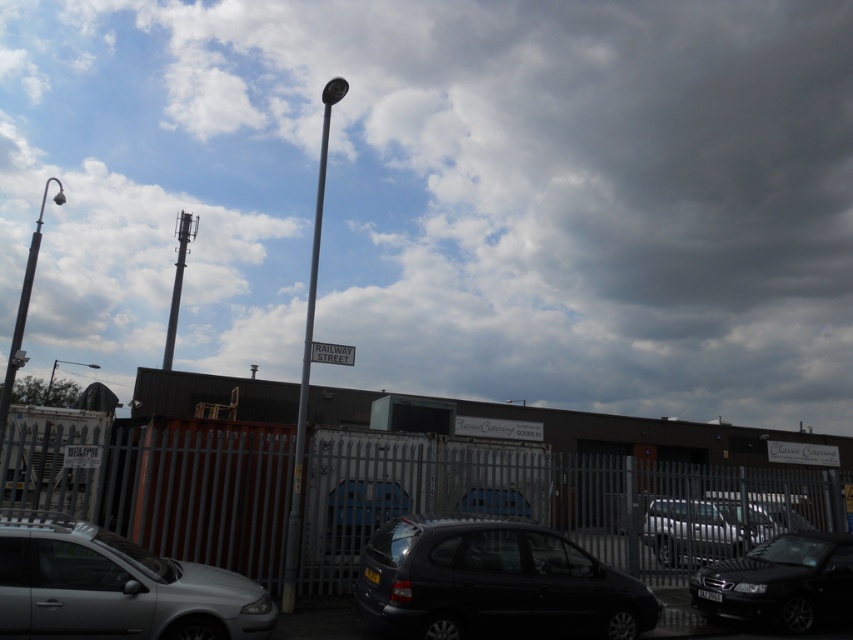
Does point (390, 547) come in front of point (833, 584)?

Yes, it is.

Locate an element on the screen. The width and height of the screenshot is (853, 640). matte black car at center is located at coordinates tap(492, 582).

Is matte black car at center in front of metallic pole at upper center?

Yes, matte black car at center is closer to the viewer.

Does matte black car at center have a greater height compared to metallic pole at upper center?

Incorrect, matte black car at center's height is not larger of metallic pole at upper center's.

Is point (543, 570) closer to camera compared to point (184, 257)?

Yes, it is.

Locate an element on the screen. The height and width of the screenshot is (640, 853). matte black car at center is located at coordinates (492, 582).

How much distance is there between black glossy car at lower right and metallic pole at upper center?

26.88 meters

Is black glossy car at lower right below metallic pole at upper center?

Yes, black glossy car at lower right is below metallic pole at upper center.

At what (x,y) coordinates should I click in order to perform the action: click on black glossy car at lower right. Please return your answer as a coordinate pair (x, y). This screenshot has width=853, height=640. Looking at the image, I should click on (780, 580).